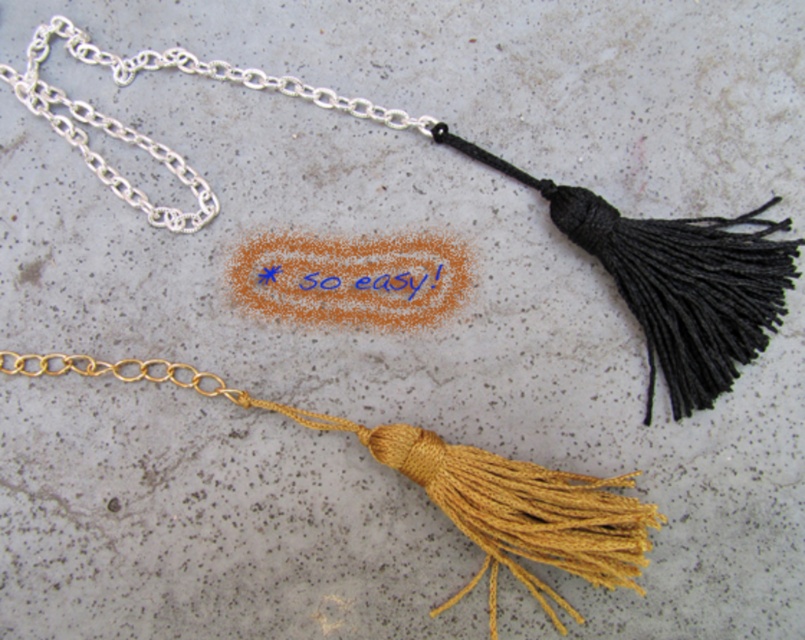
Question: Observing the image, what is the correct spatial positioning of satin gold tassel at lower center in reference to blue ink writing at center?

Choices:
 (A) right
 (B) left

Answer: (B)

Question: Does satin gold tassel at lower center appear on the right side of silver chain at upper left?

Choices:
 (A) yes
 (B) no

Answer: (A)

Question: Based on their relative distances, which object is nearer to the satin gold tassel at lower center?

Choices:
 (A) blue ink writing at center
 (B) silver chain at upper left

Answer: (A)

Question: Which point appears closest to the camera in this image?

Choices:
 (A) (89, 371)
 (B) (361, 276)

Answer: (A)

Question: Can you confirm if satin gold tassel at lower center is positioned to the right of silver chain at upper left?

Choices:
 (A) no
 (B) yes

Answer: (B)

Question: Which point is farther to the camera?

Choices:
 (A) satin gold tassel at lower center
 (B) blue ink writing at center
 (C) silver chain at upper left

Answer: (B)